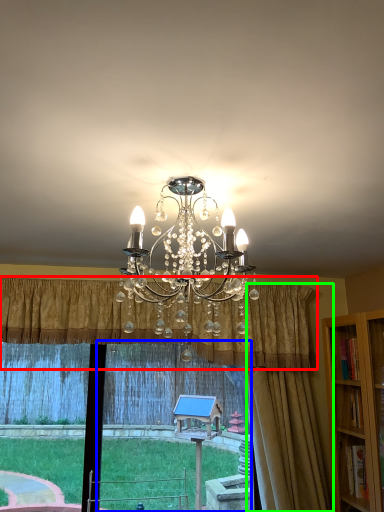
Question: Which object is the farthest from curtain (highlighted by a red box)? Choose among these: window frame (highlighted by a blue box) or curtain (highlighted by a green box).

Choices:
 (A) window frame
 (B) curtain

Answer: (A)